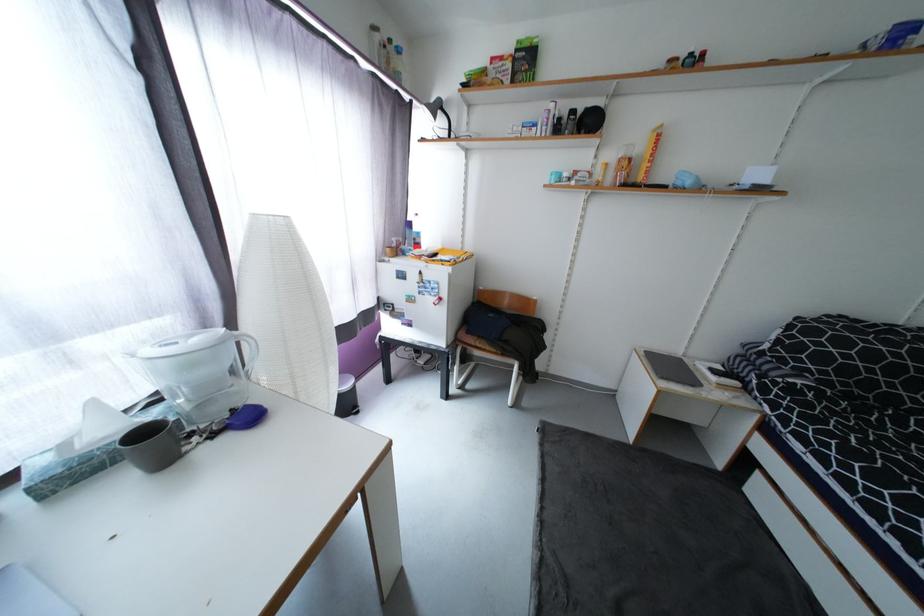
Find the location of a particular element. Image resolution: width=924 pixels, height=616 pixels. green tissue box is located at coordinates (77, 451).